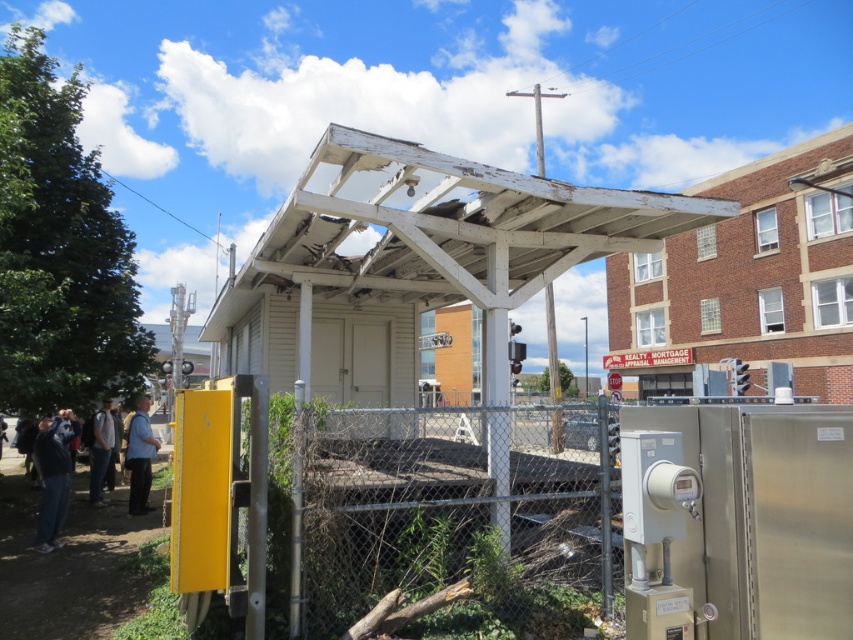
You are a delivery person trying to locate a package left at the light brown leather jacket at lower left. From your current position near the brick building at upper right, in which direction should you move to reach the jacket?

You should move to the left to reach the light brown leather jacket at lower left since the brick building at upper right is to the right of the jacket.